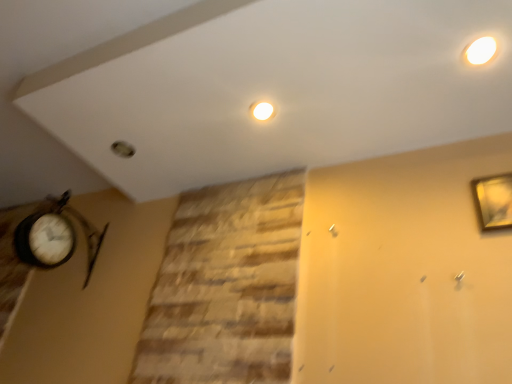
Question: Does gold metallic picture frame at upper right have a greater width compared to white glossy light fixture at upper right?

Choices:
 (A) yes
 (B) no

Answer: (B)

Question: Can you confirm if gold metallic picture frame at upper right is positioned to the left of white glossy light fixture at upper right?

Choices:
 (A) no
 (B) yes

Answer: (A)

Question: From the image's perspective, would you say gold metallic picture frame at upper right is positioned over white glossy light fixture at upper right?

Choices:
 (A) no
 (B) yes

Answer: (A)

Question: From a real-world perspective, does gold metallic picture frame at upper right sit lower than white glossy light fixture at upper right?

Choices:
 (A) no
 (B) yes

Answer: (B)

Question: Can you confirm if gold metallic picture frame at upper right is shorter than white glossy light fixture at upper right?

Choices:
 (A) yes
 (B) no

Answer: (B)

Question: Can you confirm if gold metallic picture frame at upper right is taller than white glossy light fixture at upper right?

Choices:
 (A) no
 (B) yes

Answer: (B)

Question: From a real-world perspective, does white glossy light fixture at upper right stand above gold metallic picture frame at upper right?

Choices:
 (A) yes
 (B) no

Answer: (A)

Question: Is gold metallic picture frame at upper right surrounded by white glossy light fixture at upper right?

Choices:
 (A) yes
 (B) no

Answer: (B)

Question: Does white glossy light fixture at upper right appear on the left side of gold metallic picture frame at upper right?

Choices:
 (A) yes
 (B) no

Answer: (A)

Question: Considering the relative sizes of white glossy light fixture at upper right and gold metallic picture frame at upper right in the image provided, is white glossy light fixture at upper right thinner than gold metallic picture frame at upper right?

Choices:
 (A) no
 (B) yes

Answer: (A)

Question: Is white glossy light fixture at upper right positioned far away from gold metallic picture frame at upper right?

Choices:
 (A) yes
 (B) no

Answer: (B)

Question: Are white glossy light fixture at upper right and gold metallic picture frame at upper right beside each other?

Choices:
 (A) no
 (B) yes

Answer: (A)

Question: Is white glossy light fixture at upper right wider or thinner than gold metallic picture frame at upper right?

Choices:
 (A) thin
 (B) wide

Answer: (B)